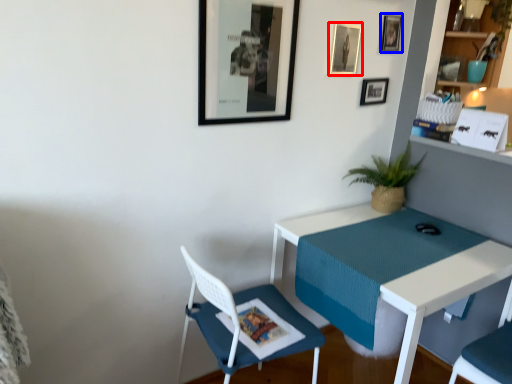
Question: Which object appears farthest to the camera in this image, picture frame (highlighted by a red box) or picture frame (highlighted by a blue box)?

Choices:
 (A) picture frame
 (B) picture frame

Answer: (B)